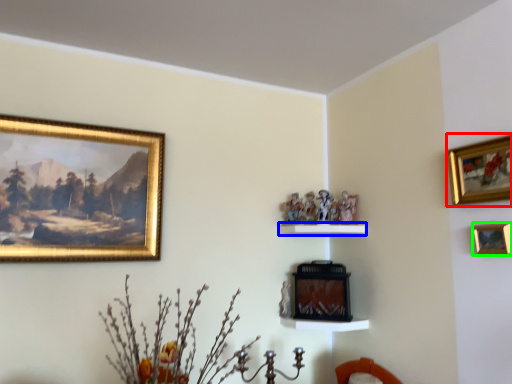
Question: Which is farther away from picture frame (highlighted by a red box)? shelf (highlighted by a blue box) or picture frame (highlighted by a green box)?

Choices:
 (A) shelf
 (B) picture frame

Answer: (A)